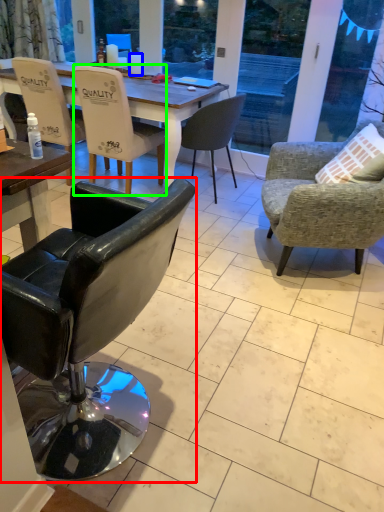
Question: Which is nearer to the chair (highlighted by a red box)? coffee cup (highlighted by a blue box) or chair (highlighted by a green box).

Choices:
 (A) coffee cup
 (B) chair

Answer: (B)